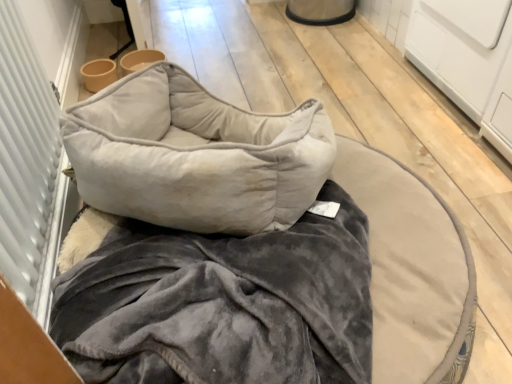
Question: Considering the relative sizes of velvet gray pillow at center and velvet gray pet bed at center in the image provided, is velvet gray pillow at center taller than velvet gray pet bed at center?

Choices:
 (A) no
 (B) yes

Answer: (B)

Question: Is velvet gray pillow at center oriented towards velvet gray pet bed at center?

Choices:
 (A) yes
 (B) no

Answer: (B)

Question: Can you confirm if velvet gray pillow at center is bigger than velvet gray pet bed at center?

Choices:
 (A) yes
 (B) no

Answer: (B)

Question: Does velvet gray pillow at center have a smaller size compared to velvet gray pet bed at center?

Choices:
 (A) no
 (B) yes

Answer: (B)

Question: Considering the relative positions of velvet gray pillow at center and velvet gray pet bed at center in the image provided, is velvet gray pillow at center behind velvet gray pet bed at center?

Choices:
 (A) no
 (B) yes

Answer: (B)

Question: Is white textured screen door at left spatially inside velvet gray pillow at center, or outside of it?

Choices:
 (A) inside
 (B) outside

Answer: (B)

Question: From a real-world perspective, is white textured screen door at left positioned above or below velvet gray pillow at center?

Choices:
 (A) above
 (B) below

Answer: (A)

Question: From the image's perspective, is white textured screen door at left above or below velvet gray pillow at center?

Choices:
 (A) above
 (B) below

Answer: (A)

Question: Is point (22, 109) positioned closer to the camera than point (298, 152)?

Choices:
 (A) closer
 (B) farther

Answer: (B)

Question: In terms of width, does velvet gray pillow at center look wider or thinner when compared to velvet gray pet bed at center?

Choices:
 (A) wide
 (B) thin

Answer: (B)

Question: Is point (288, 137) closer or farther from the camera than point (172, 377)?

Choices:
 (A) farther
 (B) closer

Answer: (A)

Question: From a real-world perspective, is velvet gray pillow at center above or below velvet gray pet bed at center?

Choices:
 (A) above
 (B) below

Answer: (A)

Question: Would you say velvet gray pillow at center is inside or outside velvet gray pet bed at center?

Choices:
 (A) inside
 (B) outside

Answer: (B)

Question: Is point (111, 140) positioned closer to the camera than point (34, 172)?

Choices:
 (A) closer
 (B) farther

Answer: (A)

Question: From a real-world perspective, is velvet gray pet bed at center positioned above or below white textured screen door at left?

Choices:
 (A) above
 (B) below

Answer: (B)